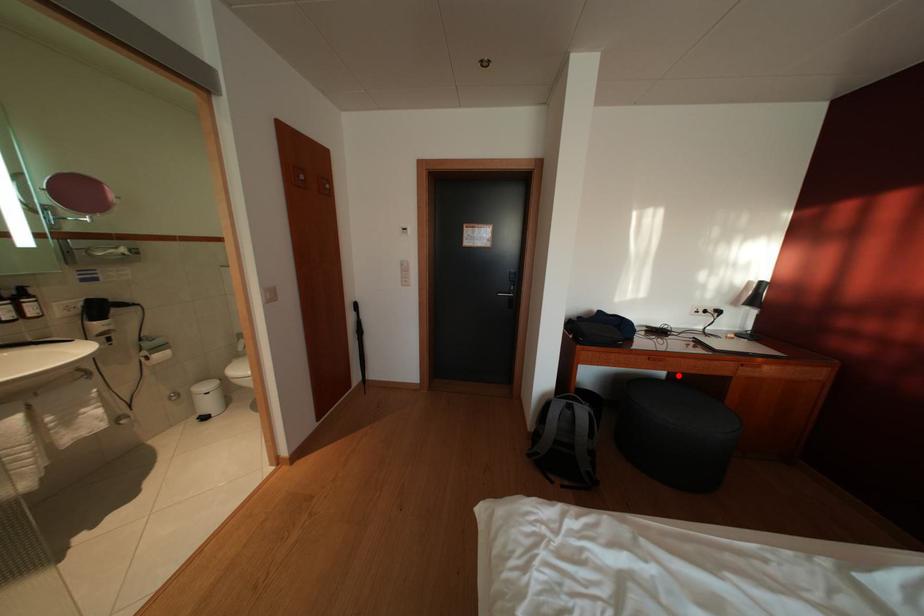
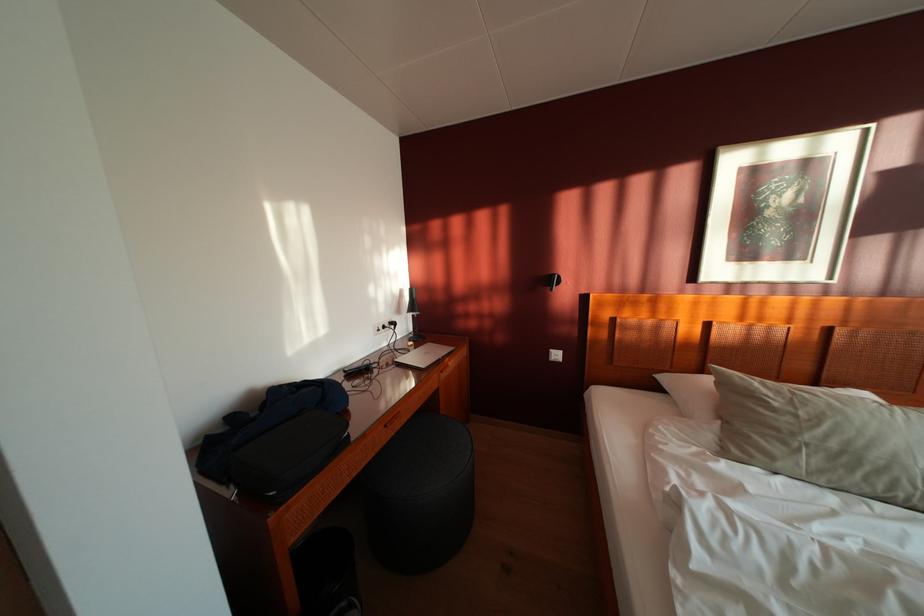
In the second image, find the point that corresponds to the highlighted location in the first image.

(412, 424)